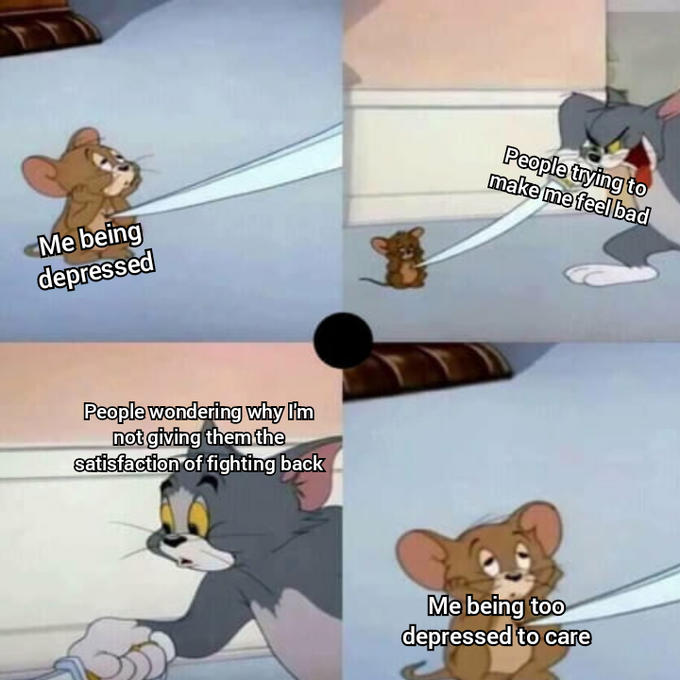
Image resolution: width=680 pixels, height=680 pixels. I want to click on floor, so click(x=613, y=464), click(x=205, y=672), click(x=207, y=236), click(x=398, y=288).